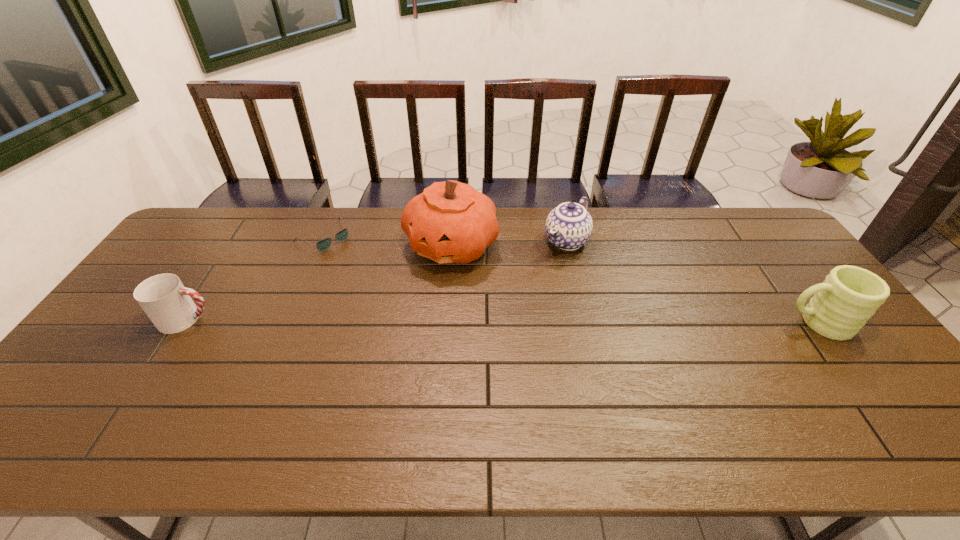
Where is `free spot on the desktop that is between the fourth tallest object and the rightmost object and is positioned at the spout of the fourth object from left to right`? The image size is (960, 540). free spot on the desktop that is between the fourth tallest object and the rightmost object and is positioned at the spout of the fourth object from left to right is located at coordinates (492, 321).

Find the location of a particular element. This screenshot has width=960, height=540. vacant space on the desktop that is between the cup and the rightmost object and is positioned on the front-facing side of the tallest object is located at coordinates (417, 321).

What are the coordinates of `vacant space on the desktop that is between the cup and the mug and is positioned on the lenses of the sunglasses` in the screenshot? It's located at [428, 321].